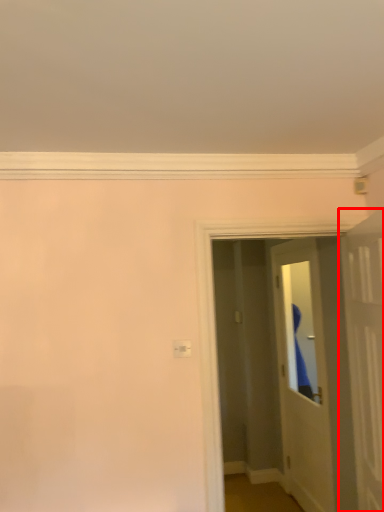
Question: From the image's perspective, what is the correct spatial positioning of door (annotated by the red box) in reference to door?

Choices:
 (A) above
 (B) below

Answer: (A)